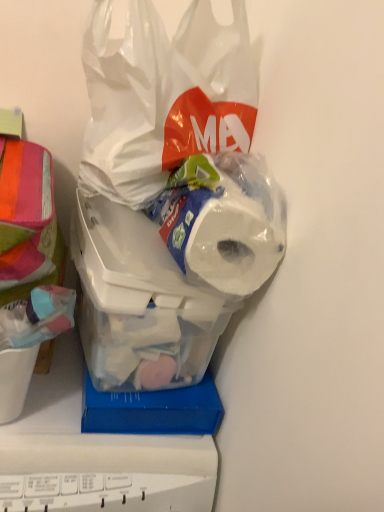
Question: Is white matte toilet paper at center surrounding transparent plastic bag at upper center?

Choices:
 (A) no
 (B) yes

Answer: (A)

Question: From a real-world perspective, is white matte toilet paper at center physically above transparent plastic bag at upper center?

Choices:
 (A) yes
 (B) no

Answer: (B)

Question: From the image's perspective, does white matte toilet paper at center appear higher than transparent plastic bag at upper center?

Choices:
 (A) yes
 (B) no

Answer: (B)

Question: Are white matte toilet paper at center and transparent plastic bag at upper center located far from each other?

Choices:
 (A) yes
 (B) no

Answer: (B)

Question: From the image's perspective, is white matte toilet paper at center located beneath transparent plastic bag at upper center?

Choices:
 (A) yes
 (B) no

Answer: (A)

Question: Is white matte toilet paper at center with transparent plastic bag at upper center?

Choices:
 (A) no
 (B) yes

Answer: (A)

Question: From a real-world perspective, is white matte toilet paper at center located higher than translucent plastic container at center?

Choices:
 (A) no
 (B) yes

Answer: (B)

Question: Considering the relative positions of white matte toilet paper at center and translucent plastic container at center in the image provided, is white matte toilet paper at center in front of translucent plastic container at center?

Choices:
 (A) yes
 (B) no

Answer: (A)

Question: Is white matte toilet paper at center bigger than translucent plastic container at center?

Choices:
 (A) no
 (B) yes

Answer: (A)

Question: Are white matte toilet paper at center and translucent plastic container at center far apart?

Choices:
 (A) yes
 (B) no

Answer: (B)

Question: Does white matte toilet paper at center have a greater height compared to translucent plastic container at center?

Choices:
 (A) no
 (B) yes

Answer: (A)

Question: Can you confirm if white matte toilet paper at center is wider than translucent plastic container at center?

Choices:
 (A) yes
 (B) no

Answer: (B)

Question: Does multicolored fabric at left have a smaller size compared to white matte toilet paper at center?

Choices:
 (A) yes
 (B) no

Answer: (B)